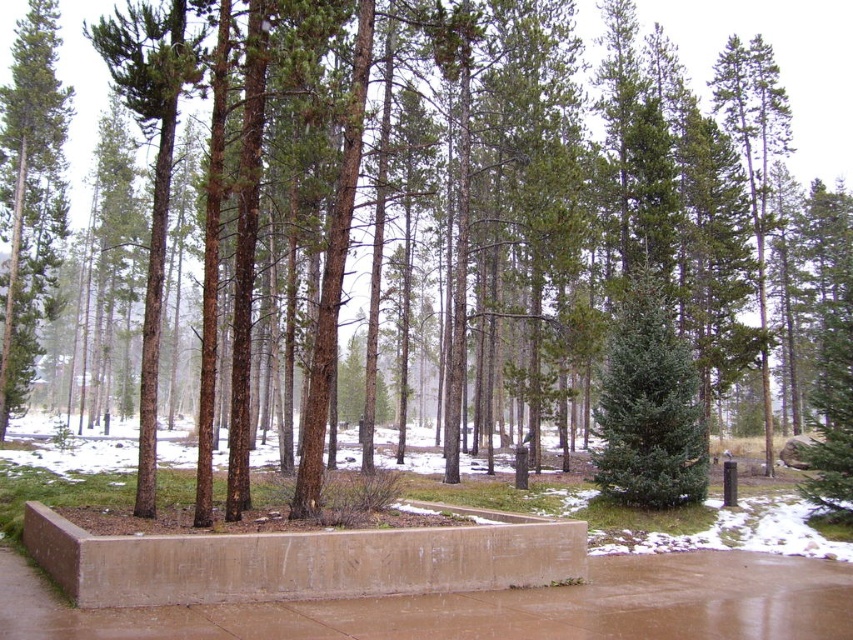
Based on the photo, can you confirm if brown concrete pavement at center is positioned above green matte evergreen tree at center?

No, brown concrete pavement at center is not above green matte evergreen tree at center.

Can you confirm if brown concrete pavement at center is positioned below green matte evergreen tree at center?

Yes.

Is point (845, 582) more distant than point (637, 316)?

No.

Where is `brown concrete pavement at center`? brown concrete pavement at center is located at coordinates (492, 605).

Who is positioned more to the left, green matte tree at left or green matte evergreen tree at center?

Positioned to the left is green matte tree at left.

Is point (38, 209) farther from camera compared to point (601, 474)?

That is True.

The height and width of the screenshot is (640, 853). I want to click on green matte tree at left, so click(x=30, y=193).

From the picture: Can you confirm if brown concrete pavement at center is positioned to the left of green matte tree at left?

No, brown concrete pavement at center is not to the left of green matte tree at left.

You are a GUI agent. You are given a task and a screenshot of the screen. Output one action in this format:
    pyautogui.click(x=<x>, y=<y>)
    Task: Click on the brown concrete pavement at center
    
    Given the screenshot: What is the action you would take?
    pyautogui.click(x=492, y=605)

This screenshot has height=640, width=853. Find the location of `brown concrete pavement at center`. brown concrete pavement at center is located at coordinates (492, 605).